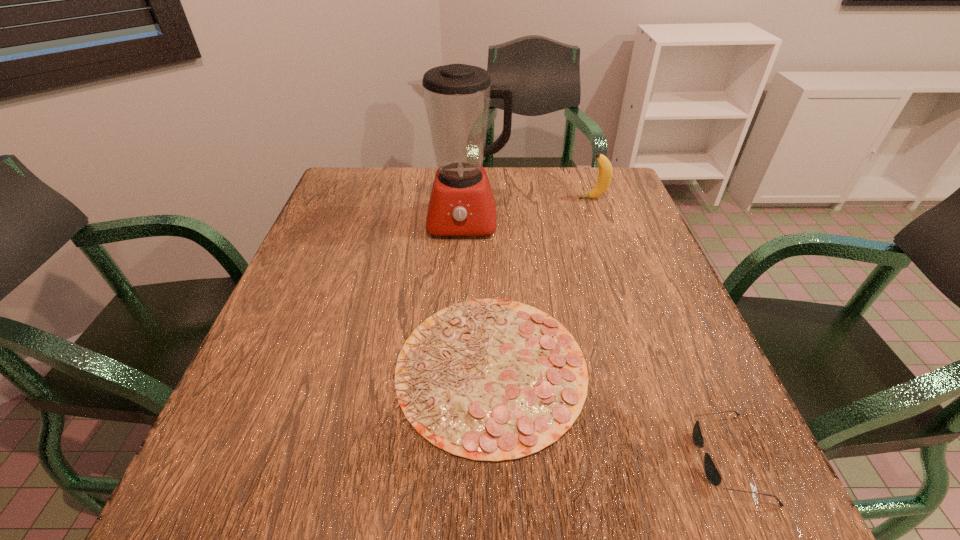
You are a GUI agent. You are given a task and a screenshot of the screen. Output one action in this format:
    pyautogui.click(x=<x>, y=<y>)
    Task: Click on the object situated at the near right corner
    The width and height of the screenshot is (960, 540).
    Given the screenshot: What is the action you would take?
    pos(711,471)

The image size is (960, 540). I want to click on vacant region at the far edge of the desktop, so click(x=556, y=180).

In the image, there is a desktop. Where is `vacant space at the near edge`? This screenshot has height=540, width=960. vacant space at the near edge is located at coordinates (371, 508).

This screenshot has width=960, height=540. In order to click on free point at the left edge in this screenshot , I will do `click(292, 308)`.

Locate an element on the screen. This screenshot has height=540, width=960. blank area at the right edge is located at coordinates (631, 282).

In the image, there is a desktop. At what (x,y) coordinates should I click in order to perform the action: click on vacant space at the far left corner. Please return your answer as a coordinate pair (x, y). The image size is (960, 540). Looking at the image, I should click on (352, 173).

The width and height of the screenshot is (960, 540). In the image, there is a desktop. Identify the location of blank space at the near left corner. (200, 490).

Locate an element on the screen. The image size is (960, 540). free spot between the sunglasses and the tallest object is located at coordinates (596, 340).

You are a GUI agent. You are given a task and a screenshot of the screen. Output one action in this format:
    pyautogui.click(x=<x>, y=<y>)
    Task: Click on the vacant area between the third shortest object and the sunglasses
    
    Given the screenshot: What is the action you would take?
    pyautogui.click(x=660, y=328)

Locate an element on the screen. The height and width of the screenshot is (540, 960). vacant space that's between the banana and the second farthest object is located at coordinates [528, 210].